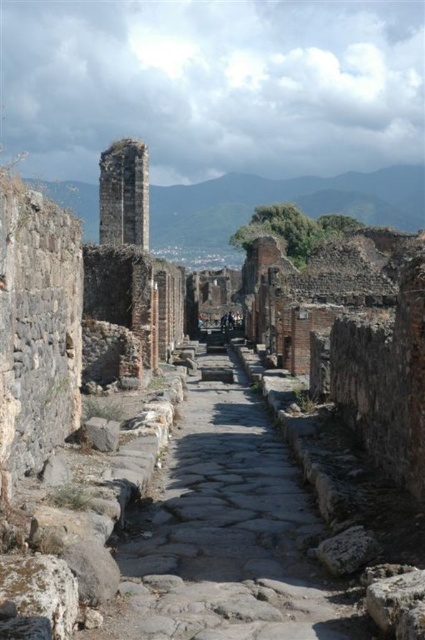
You are standing at the entrance of the ancient site and want to walk along the gray stone path at center. Based on its position, in which direction should you head from your current location?

The gray stone path at center is located at point coordinates, so you should head towards the center of the image to follow it.

You are an archaeologist exploring the ancient ruins. You see the gray stone path at center and the rusty stone tower at upper left. Which object is closer to you as you stand at the entrance of the site?

The gray stone path at center is closer to you because it is in front of the rusty stone tower at upper left, meaning the tower is further back along the path.

You are an archaeologist exploring the ancient site. You need to walk from the rusty stone tower at upper left to the gray stone path at center. Which direction should you move relative to the tower?

You should move to the right relative to the rusty stone tower at upper left because the gray stone path at center is positioned on the right side of the rusty stone tower at upper left.